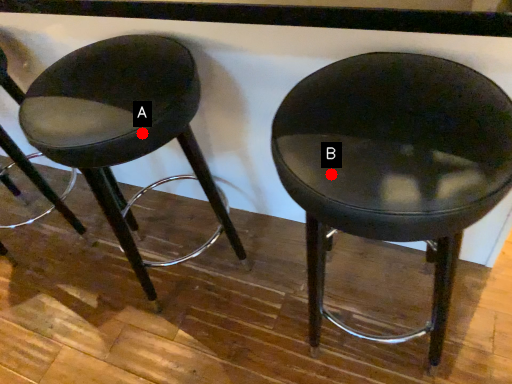
Question: Two points are circled on the image, labeled by A and B beside each circle. Which point appears closest to the camera in this image?

Choices:
 (A) A is closer
 (B) B is closer

Answer: (B)